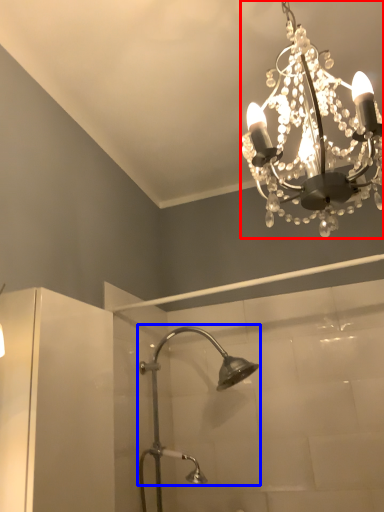
Question: Among these objects, which one is farthest to the camera, lamp (highlighted by a red box) or shower (highlighted by a blue box)?

Choices:
 (A) lamp
 (B) shower

Answer: (B)